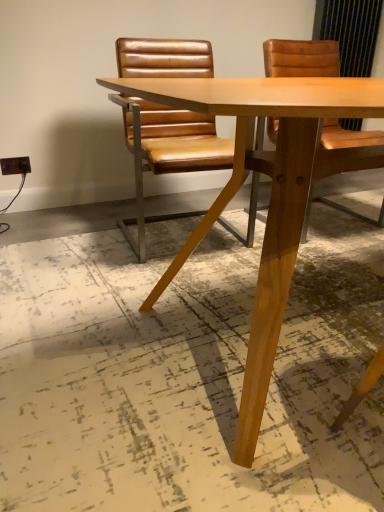
Question: Is brown leather chair at center in front of or behind light brown wood table at center in the image?

Choices:
 (A) behind
 (B) front

Answer: (A)

Question: Is brown leather chair at center bigger or smaller than light brown wood table at center?

Choices:
 (A) big
 (B) small

Answer: (B)

Question: Does point tap(163, 140) appear closer or farther from the camera than point tap(297, 244)?

Choices:
 (A) closer
 (B) farther

Answer: (B)

Question: Considering the positions of light brown wood table at center and brown leather chair at center in the image, is light brown wood table at center bigger or smaller than brown leather chair at center?

Choices:
 (A) small
 (B) big

Answer: (B)

Question: From a real-world perspective, relative to brown leather chair at center, is light brown wood table at center vertically above or below?

Choices:
 (A) above
 (B) below

Answer: (B)

Question: In terms of height, does light brown wood table at center look taller or shorter compared to brown leather chair at center?

Choices:
 (A) short
 (B) tall

Answer: (A)

Question: From the image's perspective, is light brown wood table at center located above or below brown leather chair at center?

Choices:
 (A) above
 (B) below

Answer: (B)